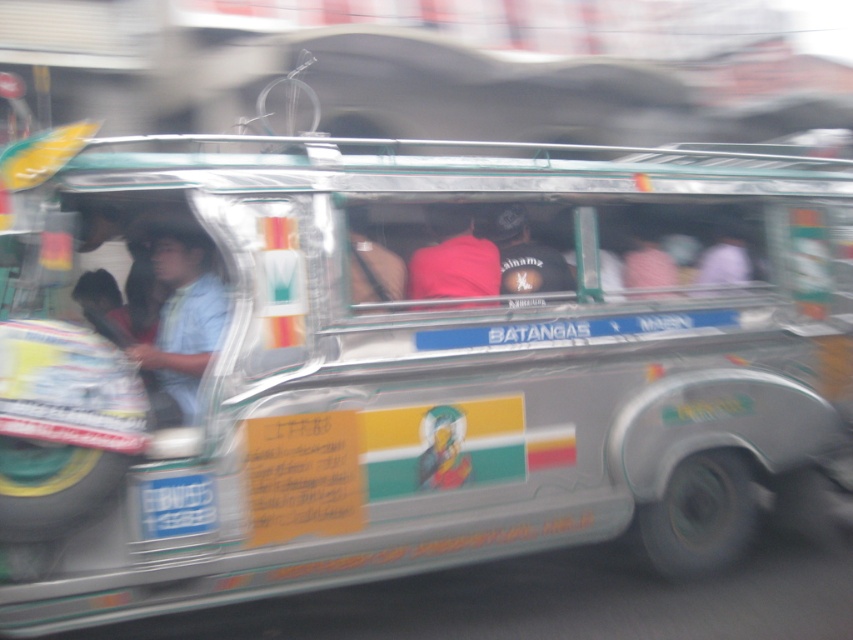
This screenshot has height=640, width=853. What do you see at coordinates (183, 324) in the screenshot?
I see `matte blue shirt at center` at bounding box center [183, 324].

Between point (218, 307) and point (444, 275), which one is positioned in front?

Point (218, 307) is more forward.

Between point (171, 326) and point (453, 218), which one is positioned in front?

Point (171, 326)

You are a GUI agent. You are given a task and a screenshot of the screen. Output one action in this format:
    pyautogui.click(x=<x>, y=<y>)
    Task: Click on the matte blue shirt at center
    This screenshot has height=640, width=853.
    Given the screenshot: What is the action you would take?
    pyautogui.click(x=183, y=324)

The width and height of the screenshot is (853, 640). What do you see at coordinates (453, 259) in the screenshot? I see `pink fabric at center` at bounding box center [453, 259].

Does pink fabric at center have a larger size compared to dark gray fabric cap at center?

Yes.

Find the location of `pink fabric at center`. pink fabric at center is located at coordinates (453, 259).

Is matte blue shirt at center positioned at the back of dark gray fabric cap at center?

No, it is in front of dark gray fabric cap at center.

Locate an element on the screen. This screenshot has height=640, width=853. matte blue shirt at center is located at coordinates (183, 324).

What do you see at coordinates (183, 324) in the screenshot?
I see `matte blue shirt at center` at bounding box center [183, 324].

The width and height of the screenshot is (853, 640). What are the coordinates of `matte blue shirt at center` in the screenshot? It's located at (183, 324).